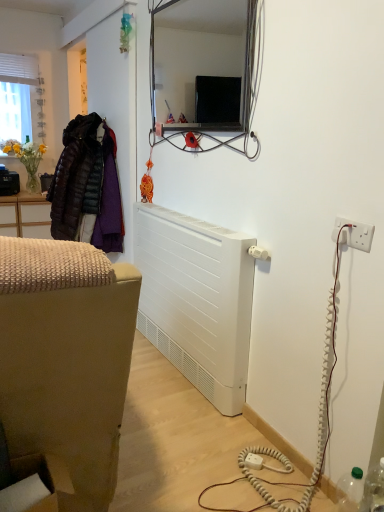
You are a GUI agent. You are given a task and a screenshot of the screen. Output one action in this format:
    pyautogui.click(x=<x>, y=<y>)
    Task: Click on the vacant space in metallic frame mirror at upper center (from a real-world perspective)
    Image resolution: width=384 pixels, height=512 pixels.
    Given the screenshot: What is the action you would take?
    pyautogui.click(x=200, y=217)